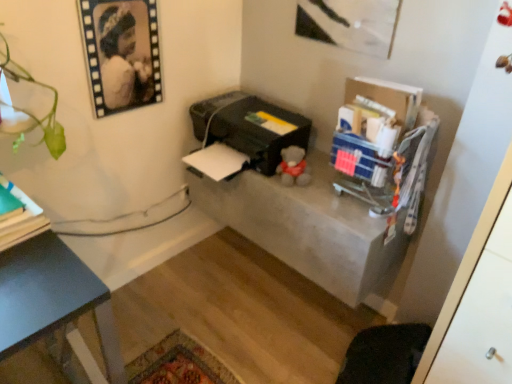
Question: Does black plastic printer at center have a larger size compared to concrete table at center?

Choices:
 (A) yes
 (B) no

Answer: (B)

Question: Does black plastic printer at center have a greater width compared to concrete table at center?

Choices:
 (A) no
 (B) yes

Answer: (B)

Question: From a real-world perspective, is black plastic printer at center positioned over concrete table at center based on gravity?

Choices:
 (A) no
 (B) yes

Answer: (B)

Question: Does black plastic printer at center appear on the right side of concrete table at center?

Choices:
 (A) yes
 (B) no

Answer: (B)

Question: Is black plastic printer at center facing away from concrete table at center?

Choices:
 (A) yes
 (B) no

Answer: (B)

Question: Is black matte portrait at upper left situated inside concrete table at center or outside?

Choices:
 (A) inside
 (B) outside

Answer: (B)

Question: From the image's perspective, is black matte portrait at upper left above or below concrete table at center?

Choices:
 (A) below
 (B) above

Answer: (B)

Question: From a real-world perspective, is black matte portrait at upper left above or below concrete table at center?

Choices:
 (A) below
 (B) above

Answer: (B)

Question: In terms of size, does black matte portrait at upper left appear bigger or smaller than concrete table at center?

Choices:
 (A) big
 (B) small

Answer: (B)

Question: From the image's perspective, is black plastic printer at center located above or below black matte portrait at upper left?

Choices:
 (A) above
 (B) below

Answer: (B)

Question: Considering the relative positions of black plastic printer at center and black matte portrait at upper left in the image provided, is black plastic printer at center to the left or to the right of black matte portrait at upper left?

Choices:
 (A) right
 (B) left

Answer: (A)

Question: From a real-world perspective, is black plastic printer at center above or below black matte portrait at upper left?

Choices:
 (A) below
 (B) above

Answer: (A)

Question: Would you say black plastic printer at center is inside or outside black matte portrait at upper left?

Choices:
 (A) outside
 (B) inside

Answer: (A)

Question: From the image's perspective, is green matte book at left located above or below black matte portrait at upper left?

Choices:
 (A) below
 (B) above

Answer: (A)

Question: In terms of width, does green matte book at left look wider or thinner when compared to black matte portrait at upper left?

Choices:
 (A) wide
 (B) thin

Answer: (A)